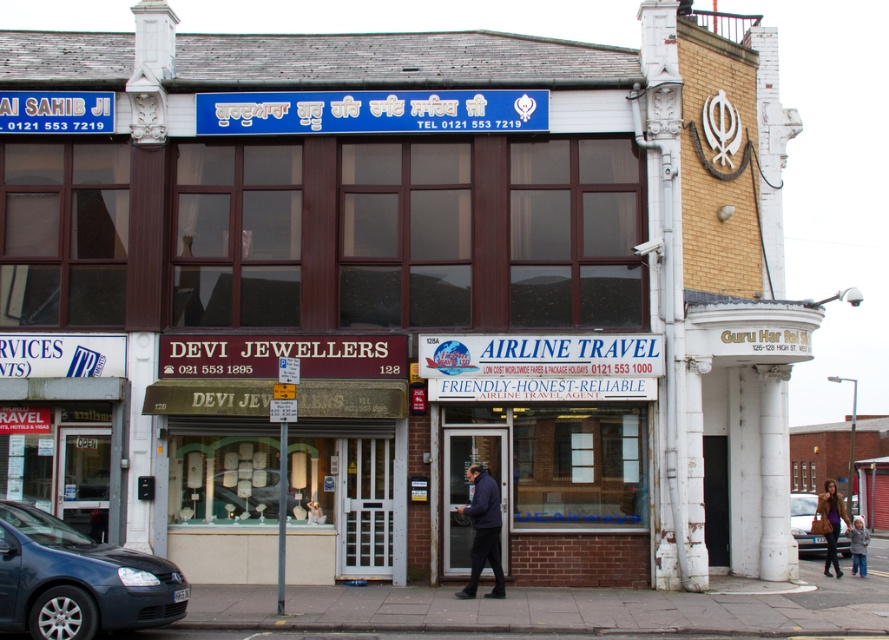
Who is more forward, (839, 550) or (819, 496)?

Positioned in front is point (839, 550).

Between matte brown car at lower right and brown leather coat at lower right, which one is positioned lower?

Positioned lower is brown leather coat at lower right.

Who is more forward, (819, 547) or (829, 508)?

Point (829, 508) is in front.

Locate an element on the screen. matte brown car at lower right is located at coordinates (805, 524).

Is metallic blue car at lower left to the right of matte brown car at lower right from the viewer's perspective?

No, metallic blue car at lower left is not to the right of matte brown car at lower right.

Which of these two, metallic blue car at lower left or matte brown car at lower right, stands taller?

matte brown car at lower right

Between point (7, 563) and point (809, 540), which one is positioned in front?

Positioned in front is point (7, 563).

Where is `metallic blue car at lower left`? Image resolution: width=889 pixels, height=640 pixels. metallic blue car at lower left is located at coordinates (78, 580).

Describe the element at coordinates (831, 522) in the screenshot. This screenshot has height=640, width=889. I see `brown leather coat at lower right` at that location.

Consider the image. Is brown leather coat at lower right below light blue knit hat at lower right?

No, brown leather coat at lower right is not below light blue knit hat at lower right.

Between point (847, 531) and point (854, 532), which one is positioned behind?

Point (847, 531)

Locate an element on the screen. The height and width of the screenshot is (640, 889). brown leather coat at lower right is located at coordinates (831, 522).